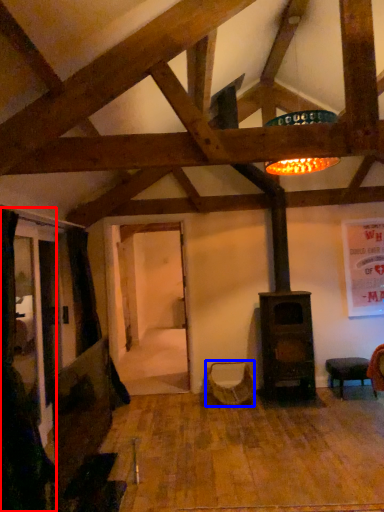
Question: Which point is further to the camera, curtain (highlighted by a red box) or swivel chair (highlighted by a blue box)?

Choices:
 (A) curtain
 (B) swivel chair

Answer: (B)